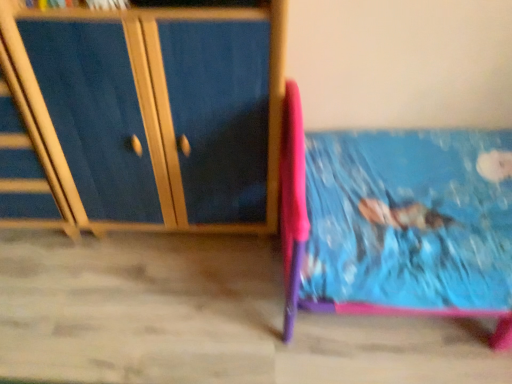
What is the approximate width of wooden drawer at left?

The width of wooden drawer at left is 40.63 centimeters.

This screenshot has height=384, width=512. I want to click on wooden drawer at left, so click(x=95, y=115).

What do you see at coordinates (95, 115) in the screenshot? I see `wooden drawer at left` at bounding box center [95, 115].

The image size is (512, 384). What do you see at coordinates (152, 114) in the screenshot?
I see `blue wood cabinet at left` at bounding box center [152, 114].

Measure the distance between point (x=63, y=106) and camera.

The distance of point (x=63, y=106) from camera is 3.99 feet.

At what (x,y) coordinates should I click in order to perform the action: click on blue wood cabinet at left. Please return your answer as a coordinate pair (x, y). The image size is (512, 384). Looking at the image, I should click on (152, 114).

This screenshot has height=384, width=512. What are the coordinates of `wooden drawer at left` in the screenshot? It's located at 95,115.

Does wooden drawer at left appear on the right side of blue wood cabinet at left?

No.

Is wooden drawer at left in front of blue wood cabinet at left?

No, wooden drawer at left is further to the viewer.

Considering the points (114, 198) and (155, 119), which point is behind, point (114, 198) or point (155, 119)?

The point (114, 198) is farther from the camera.

From the image's perspective, is wooden drawer at left located above or below blue wood cabinet at left?

Clearly, from the image's perspective, wooden drawer at left is below blue wood cabinet at left.

From a real-world perspective, is wooden drawer at left located higher than blue wood cabinet at left?

No, from a real-world perspective, wooden drawer at left is not over blue wood cabinet at left

Does wooden drawer at left have a greater width compared to blue wood cabinet at left?

No, wooden drawer at left is not wider than blue wood cabinet at left.

In terms of height, does wooden drawer at left look taller or shorter compared to blue wood cabinet at left?

Clearly, wooden drawer at left is shorter compared to blue wood cabinet at left.

Considering the sizes of objects wooden drawer at left and blue wood cabinet at left in the image provided, who is smaller, wooden drawer at left or blue wood cabinet at left?

wooden drawer at left is smaller.

Choose the correct answer: Is wooden drawer at left inside blue wood cabinet at left or outside it?

wooden drawer at left lies outside blue wood cabinet at left.

Is wooden drawer at left positioned far away from blue wood cabinet at left?

They are positioned close to each other.

Could you tell me if wooden drawer at left is turned towards blue wood cabinet at left?

No, wooden drawer at left is not aimed at blue wood cabinet at left.

How different are the orientations of wooden drawer at left and blue wood cabinet at left in degrees?

The angular difference between wooden drawer at left and blue wood cabinet at left is 0.000414 degrees.

How far apart are wooden drawer at left and blue wood cabinet at left?

wooden drawer at left is 3.22 inches from blue wood cabinet at left.

Locate an element on the screen. Image resolution: width=512 pixels, height=384 pixels. furniture in front of the wooden drawer at left is located at coordinates (152, 114).

Would you say blue wood cabinet at left is to the left or to the right of wooden drawer at left in the picture?

blue wood cabinet at left is to the right of wooden drawer at left.

In the image, is blue wood cabinet at left positioned in front of or behind wooden drawer at left?

blue wood cabinet at left is positioned closer to the viewer than wooden drawer at left.

Is point (232, 79) farther from camera compared to point (105, 28)?

Yes, it is.

From the image's perspective, is blue wood cabinet at left located above or below wooden drawer at left?

From the image's perspective, blue wood cabinet at left appears above wooden drawer at left.

From a real-world perspective, is blue wood cabinet at left on wooden drawer at left?

Yes, from a real-world perspective, blue wood cabinet at left is above wooden drawer at left.

Which object is thinner, blue wood cabinet at left or wooden drawer at left?

wooden drawer at left is thinner.

Between blue wood cabinet at left and wooden drawer at left, which one has more height?

Standing taller between the two is blue wood cabinet at left.

Does blue wood cabinet at left have a larger size compared to wooden drawer at left?

Yes, blue wood cabinet at left is bigger than wooden drawer at left.

Does blue wood cabinet at left contain wooden drawer at left?

No.

Is blue wood cabinet at left positioned far away from wooden drawer at left?

Actually, blue wood cabinet at left and wooden drawer at left are a little close together.

Is blue wood cabinet at left oriented away from wooden drawer at left?

That's not correct — blue wood cabinet at left is not looking away from wooden drawer at left.

How much distance is there between blue wood cabinet at left and wooden drawer at left?

blue wood cabinet at left is 3.22 inches away from wooden drawer at left.

You are a GUI agent. You are given a task and a screenshot of the screen. Output one action in this format:
    pyautogui.click(x=<x>, y=<y>)
    Task: Click on the drawer that appears below the blue wood cabinet at left (from the image's perspective)
    The height and width of the screenshot is (384, 512).
    Given the screenshot: What is the action you would take?
    pyautogui.click(x=95, y=115)

You are a GUI agent. You are given a task and a screenshot of the screen. Output one action in this format:
    pyautogui.click(x=<x>, y=<y>)
    Task: Click on the drawer below the blue wood cabinet at left (from a real-world perspective)
    The height and width of the screenshot is (384, 512).
    Given the screenshot: What is the action you would take?
    pyautogui.click(x=95, y=115)

The width and height of the screenshot is (512, 384). I want to click on drawer below the blue wood cabinet at left (from the image's perspective), so (95, 115).